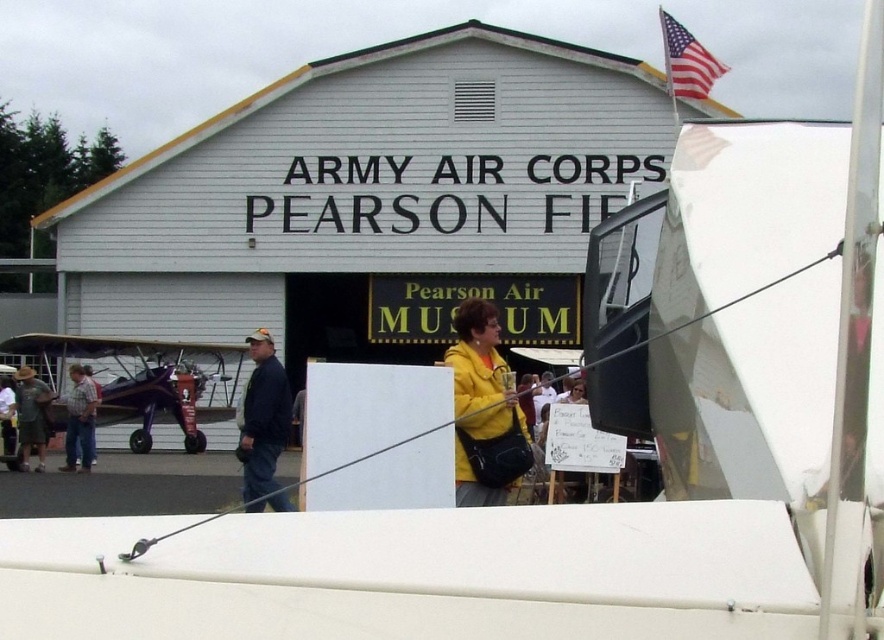
Who is more forward, (344, 132) or (90, 404)?

Positioned in front is point (90, 404).

This screenshot has width=884, height=640. What do you see at coordinates (364, 192) in the screenshot? I see `white matte building at center` at bounding box center [364, 192].

The image size is (884, 640). What do you see at coordinates (364, 192) in the screenshot?
I see `white matte building at center` at bounding box center [364, 192].

At what (x,y) coordinates should I click in order to perform the action: click on white matte building at center. Please return your answer as a coordinate pair (x, y). This screenshot has height=640, width=884. Looking at the image, I should click on (364, 192).

Who is taller, purple matte biplane at left or blue denim jeans at center?

blue denim jeans at center is taller.

Can you confirm if purple matte biplane at left is positioned above blue denim jeans at center?

No, purple matte biplane at left is not above blue denim jeans at center.

Where is `purple matte biplane at left`? The height and width of the screenshot is (640, 884). purple matte biplane at left is located at coordinates (149, 380).

Can you confirm if plaid shirt at left is wider than dark blue jeans at center?

Yes, plaid shirt at left is wider than dark blue jeans at center.

Between point (90, 449) and point (549, 381), which one is positioned behind?

The point (549, 381) is more distant.

The height and width of the screenshot is (640, 884). Describe the element at coordinates (79, 420) in the screenshot. I see `plaid shirt at left` at that location.

Find the location of `plaid shirt at left`. plaid shirt at left is located at coordinates (79, 420).